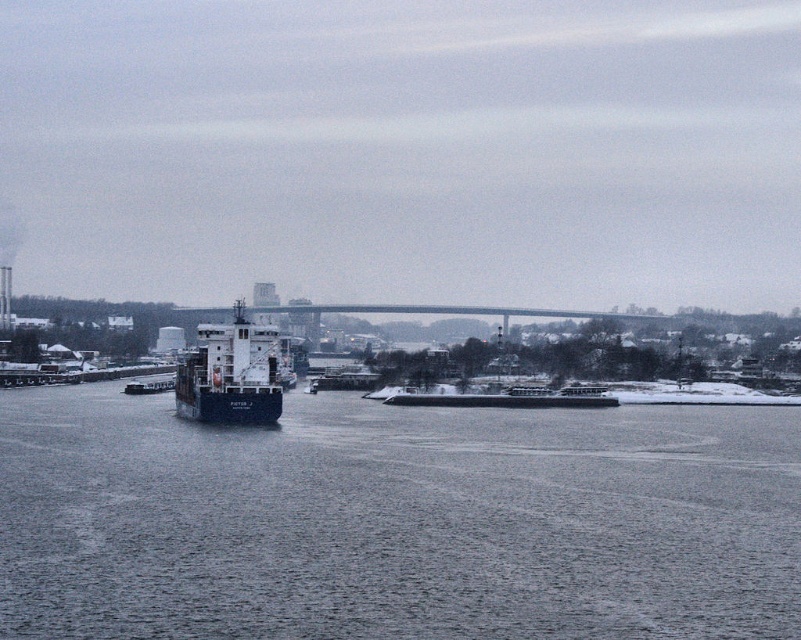
You are a drone operator trying to capture a photo of the gray water at center and the white matte barge at center. Based on their heights, which one should you focus on to ensure it appears larger in the photo?

The white matte barge at center should be focused on because it has a greater height than the gray water at center, making it appear larger in the photo.

You are a photographer trying to capture the cargo ship PICTOR J in the river scene. You want to ensure that both the point at coordinates point (67,524) and point (226,337) are in focus. Which point should you focus on to ensure both are sharp?

You should focus on the point that is farther from the camera, which is point (226,337). This way, the depth of field will include both the closer point (67,524) and the farther point (226,337).

You are a photographer trying to capture the white matte barge at center from the shore. Since the gray water at center is in the way, will you need to adjust your angle to avoid the water?

The gray water at center is closer to the viewer than the white matte barge at center, so you will need to adjust your angle to avoid capturing the water in front of the barge.